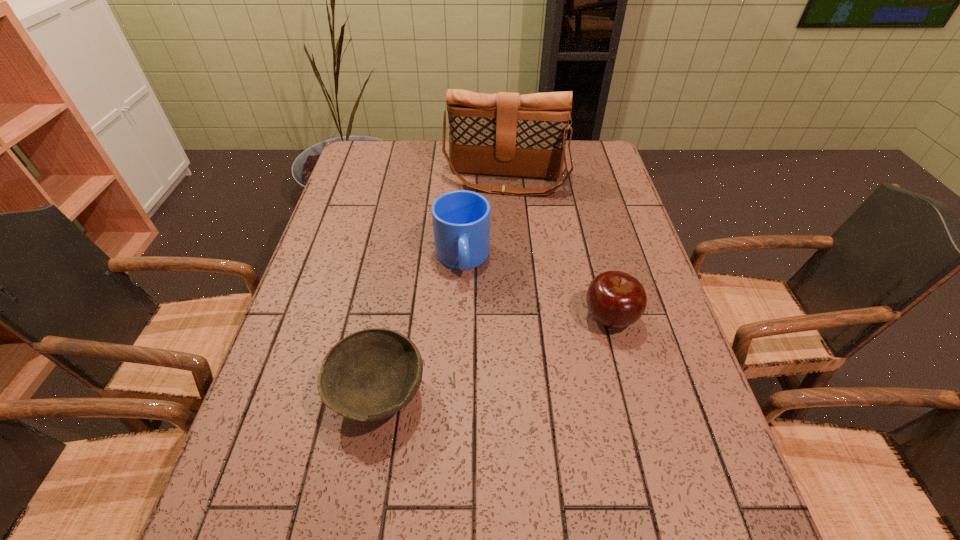
The height and width of the screenshot is (540, 960). I want to click on vacant space located on the front-facing side of the shoulder bag, so 491,258.

This screenshot has width=960, height=540. What are the coordinates of `free space located 0.050m on the side of the third nearest object with the handle` in the screenshot? It's located at pyautogui.click(x=466, y=300).

Locate an element on the screen. The width and height of the screenshot is (960, 540). free space located 0.140m on the side of the third nearest object with the handle is located at coordinates (469, 329).

Locate an element on the screen. This screenshot has height=540, width=960. free space located on the side of the third nearest object with the handle is located at coordinates (474, 377).

Locate an element on the screen. object at the far edge is located at coordinates (507, 134).

In order to click on object present at the near edge in this screenshot , I will do `click(369, 375)`.

Find the location of `object that is at the left edge`. object that is at the left edge is located at coordinates (369, 375).

I want to click on object at the right edge, so click(x=615, y=299).

Find the location of `object that is at the near left corner`. object that is at the near left corner is located at coordinates (369, 375).

This screenshot has width=960, height=540. I want to click on vacant space at the near edge, so click(x=523, y=472).